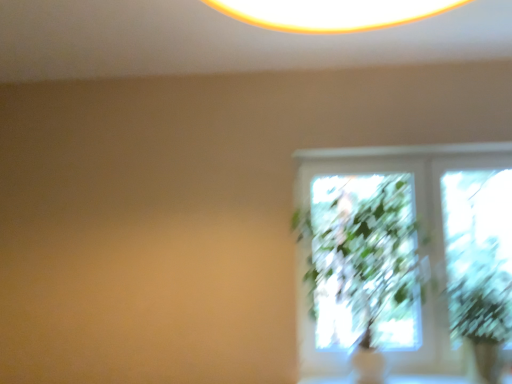
Question: Is green leafy plant at right not inside green leafy plant at right?

Choices:
 (A) yes
 (B) no

Answer: (A)

Question: From the image's perspective, is green leafy plant at right above green leafy plant at right?

Choices:
 (A) yes
 (B) no

Answer: (B)

Question: From a real-world perspective, is green leafy plant at right located higher than green leafy plant at right?

Choices:
 (A) yes
 (B) no

Answer: (B)

Question: From a real-world perspective, is green leafy plant at right located beneath green leafy plant at right?

Choices:
 (A) yes
 (B) no

Answer: (A)

Question: Is green leafy plant at right far away from green leafy plant at right?

Choices:
 (A) no
 (B) yes

Answer: (A)

Question: Does green leafy plant at right have a smaller size compared to green leafy plant at right?

Choices:
 (A) no
 (B) yes

Answer: (B)

Question: Can you see green leafy plant at right touching green leafy plant at right?

Choices:
 (A) yes
 (B) no

Answer: (B)

Question: Does green leafy plant at right have a lesser width compared to green leafy plant at right?

Choices:
 (A) no
 (B) yes

Answer: (A)

Question: Is green leafy plant at right not near green leafy plant at right?

Choices:
 (A) yes
 (B) no

Answer: (B)

Question: From a real-world perspective, is green leafy plant at right under green leafy plant at right?

Choices:
 (A) no
 (B) yes

Answer: (A)

Question: Is green leafy plant at right located outside green leafy plant at right?

Choices:
 (A) no
 (B) yes

Answer: (B)

Question: Is green leafy plant at right closer to camera compared to green leafy plant at right?

Choices:
 (A) yes
 (B) no

Answer: (A)

Question: Considering their positions, is green leafy plant at right located in front of or behind green leafy plant at right?

Choices:
 (A) behind
 (B) front

Answer: (A)